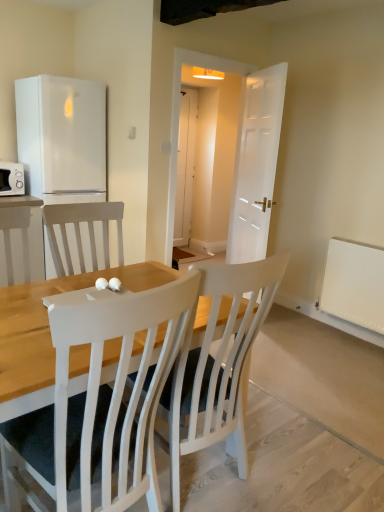
Question: From a real-world perspective, is white matte radiator at lower right above or below white wood chair at center?

Choices:
 (A) above
 (B) below

Answer: (A)

Question: Is point (369, 287) positioned closer to the camera than point (100, 404)?

Choices:
 (A) farther
 (B) closer

Answer: (A)

Question: Which of these objects is positioned closest to the white wood chair at center?

Choices:
 (A) white matte microwave at left
 (B) white matte radiator at lower right
 (C) white matte refrigerator at left

Answer: (B)

Question: Which object is positioned farthest from the white matte refrigerator at left?

Choices:
 (A) white matte radiator at lower right
 (B) white matte microwave at left
 (C) white wood chair at center

Answer: (C)